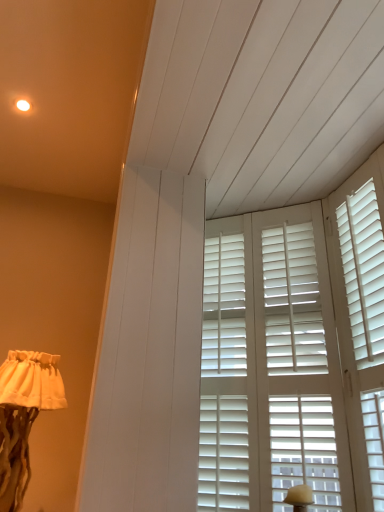
Describe the element at coordinates (295, 353) in the screenshot. I see `white matte shutters at center` at that location.

Find the location of a particular element. The height and width of the screenshot is (512, 384). white matte shutters at center is located at coordinates tap(295, 353).

Measure the distance between point (312, 453) and camera.

Point (312, 453) and camera are 1.38 meters apart.

Image resolution: width=384 pixels, height=512 pixels. What do you see at coordinates (23, 416) in the screenshot?
I see `white fabric lampshade at lower left` at bounding box center [23, 416].

Find the location of a particular element. The height and width of the screenshot is (512, 384). white fabric lampshade at lower left is located at coordinates (23, 416).

Identify the location of white matte shutters at center. The image size is (384, 512). (295, 353).

Considering the positions of objects white matte shutters at center and white fabric lampshade at lower left in the image provided, who is more to the left, white matte shutters at center or white fabric lampshade at lower left?

white fabric lampshade at lower left.

Which is behind, white matte shutters at center or white fabric lampshade at lower left?

white fabric lampshade at lower left is further from the camera.

Does point (334, 256) lie in front of point (46, 386)?

Yes.

From the image's perspective, would you say white matte shutters at center is positioned over white fabric lampshade at lower left?

Yes, from the image's perspective, white matte shutters at center is over white fabric lampshade at lower left.

From a real-world perspective, is white matte shutters at center physically below white fabric lampshade at lower left?

Incorrect, from a real-world perspective, white matte shutters at center is higher than white fabric lampshade at lower left.

Looking at their sizes, would you say white matte shutters at center is wider or thinner than white fabric lampshade at lower left?

Clearly, white matte shutters at center has less width compared to white fabric lampshade at lower left.

From the picture: Can you confirm if white matte shutters at center is shorter than white fabric lampshade at lower left?

In fact, white matte shutters at center may be taller than white fabric lampshade at lower left.

Does white matte shutters at center have a smaller size compared to white fabric lampshade at lower left?

Yes.

Which is correct: white matte shutters at center is inside white fabric lampshade at lower left, or outside of it?

The correct answer is: outside.

In the scene shown: Is white matte shutters at center not near white fabric lampshade at lower left?

That's not correct — white matte shutters at center is a little close to white fabric lampshade at lower left.

Is white matte shutters at center positioned with its back to white fabric lampshade at lower left?

No.

Locate an element on the screen. lamp on the left of white matte shutters at center is located at coordinates (23, 416).

Does white fabric lampshade at lower left appear on the left side of white matte shutters at center?

Correct, you'll find white fabric lampshade at lower left to the left of white matte shutters at center.

Based on the photo, which object is closer to the camera taking this photo, white fabric lampshade at lower left or white matte shutters at center?

white matte shutters at center is in front.

Does point (28, 362) come farther from viewer compared to point (353, 509)?

Yes, point (28, 362) is behind point (353, 509).

From the image's perspective, is white fabric lampshade at lower left located above or below white matte shutters at center?

From the image's perspective, white fabric lampshade at lower left appears below white matte shutters at center.

Consider the image. From a real-world perspective, is white fabric lampshade at lower left physically located above or below white matte shutters at center?

In terms of real-world spatial position, white fabric lampshade at lower left is below white matte shutters at center.

Considering the sizes of objects white fabric lampshade at lower left and white matte shutters at center in the image provided, who is thinner, white fabric lampshade at lower left or white matte shutters at center?

white matte shutters at center.

From the picture: Can you confirm if white fabric lampshade at lower left is shorter than white matte shutters at center?

Yes, white fabric lampshade at lower left is shorter than white matte shutters at center.

Can you confirm if white fabric lampshade at lower left is smaller than white matte shutters at center?

No.

Is white fabric lampshade at lower left inside or outside of white matte shutters at center?

The correct answer is: outside.

Is white fabric lampshade at lower left far from white matte shutters at center?

No, white fabric lampshade at lower left is not far away from white matte shutters at center.

Is white fabric lampshade at lower left looking in the opposite direction of white matte shutters at center?

white fabric lampshade at lower left is not turned away from white matte shutters at center.

What's the angular difference between white fabric lampshade at lower left and white matte shutters at center's facing directions?

white fabric lampshade at lower left and white matte shutters at center are facing 56.8 degrees away from each other.

How far apart are white fabric lampshade at lower left and white matte shutters at center?

A distance of 34.74 inches exists between white fabric lampshade at lower left and white matte shutters at center.

At what (x,y) coordinates should I click in order to perform the action: click on lamp below the white matte shutters at center (from a real-world perspective). Please return your answer as a coordinate pair (x, y). The height and width of the screenshot is (512, 384). Looking at the image, I should click on (23, 416).

The height and width of the screenshot is (512, 384). In order to click on lamp directly beneath the white matte shutters at center (from a real-world perspective) in this screenshot , I will do `click(23, 416)`.

Locate an element on the screen. This screenshot has width=384, height=512. lamp behind the white matte shutters at center is located at coordinates (23, 416).